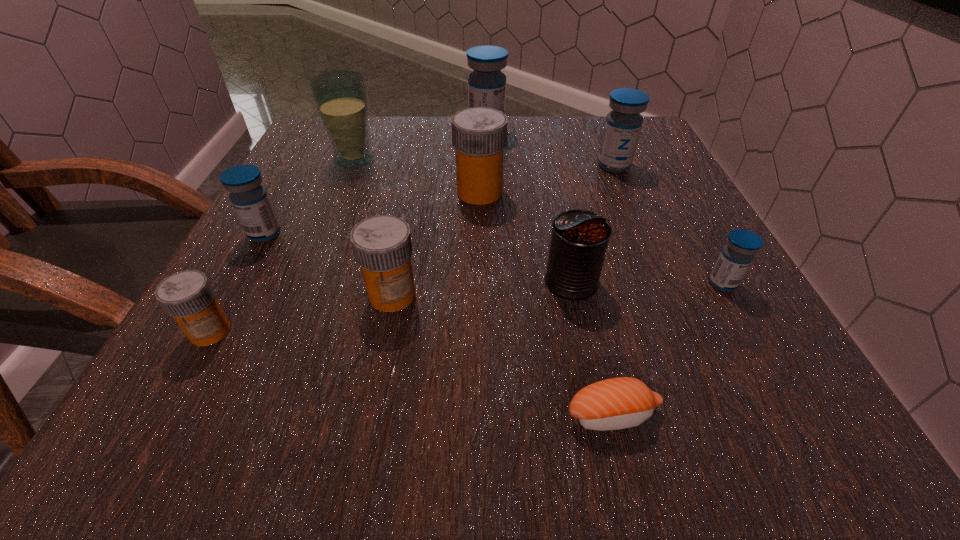
Locate an element on the screen. object situated at the near edge is located at coordinates (617, 403).

At what (x,y) coordinates should I click in order to perform the action: click on glass that is positioned at the left edge. Please return your answer as a coordinate pair (x, y). This screenshot has width=960, height=540. Looking at the image, I should click on (340, 96).

This screenshot has height=540, width=960. Find the location of `object positioned at the far left corner`. object positioned at the far left corner is located at coordinates (340, 96).

Find the location of a particular element. The width and height of the screenshot is (960, 540). object that is at the far right corner is located at coordinates (623, 124).

In order to click on free space at the far edge in this screenshot , I will do `click(508, 124)`.

Locate an element on the screen. Image resolution: width=960 pixels, height=540 pixels. vacant region at the near edge of the desktop is located at coordinates (489, 414).

In the image, there is a desktop. Identify the location of vacant space at the left edge. (303, 212).

At what (x,y) coordinates should I click in order to perform the action: click on free space at the right edge of the desktop. Please return your answer as a coordinate pair (x, y). Looking at the image, I should click on (729, 368).

You are a GUI agent. You are given a task and a screenshot of the screen. Output one action in this format:
    pyautogui.click(x=<x>, y=<y>)
    Task: Click on the free space at the near right corner
    
    Given the screenshot: What is the action you would take?
    pyautogui.click(x=735, y=393)

You are a GUI agent. You are given a task and a screenshot of the screen. Output one action in this format:
    pyautogui.click(x=<x>, y=<y>)
    Task: Click on the free space between the fourth farthest medicine and the ninth object from left to right
    The image size is (960, 540).
    Given the screenshot: What is the action you would take?
    pyautogui.click(x=440, y=200)